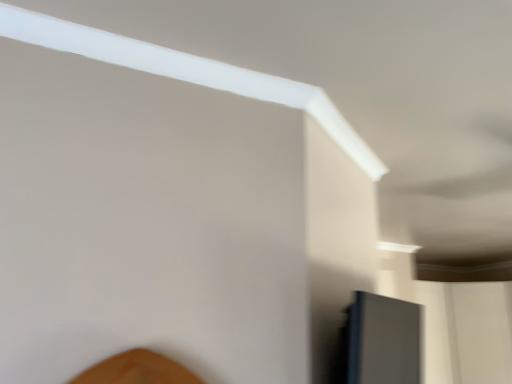
What is the approximate height of satin black frame at lower right?

It is 11.93 inches.

What do you see at coordinates (382, 341) in the screenshot? I see `satin black frame at lower right` at bounding box center [382, 341].

In order to face satin black frame at lower right, should I rotate leftwards or rightwards?

To face it directly, rotate right by 16.875 degrees.

Locate an element on the screen. The width and height of the screenshot is (512, 384). satin black frame at lower right is located at coordinates (382, 341).

What are the coordinates of `satin black frame at lower right` in the screenshot? It's located at (382, 341).